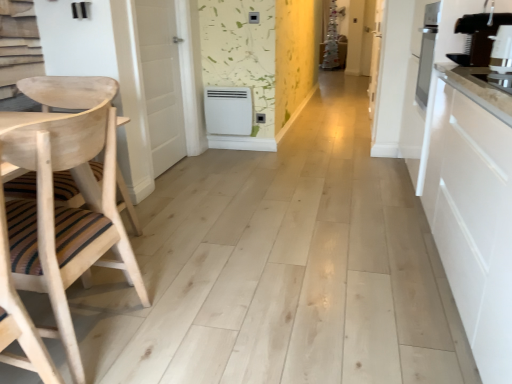
The image size is (512, 384). Identify the location of vacant space that is to the left of white wood door at center, the second door positioned from the left. (344, 127).